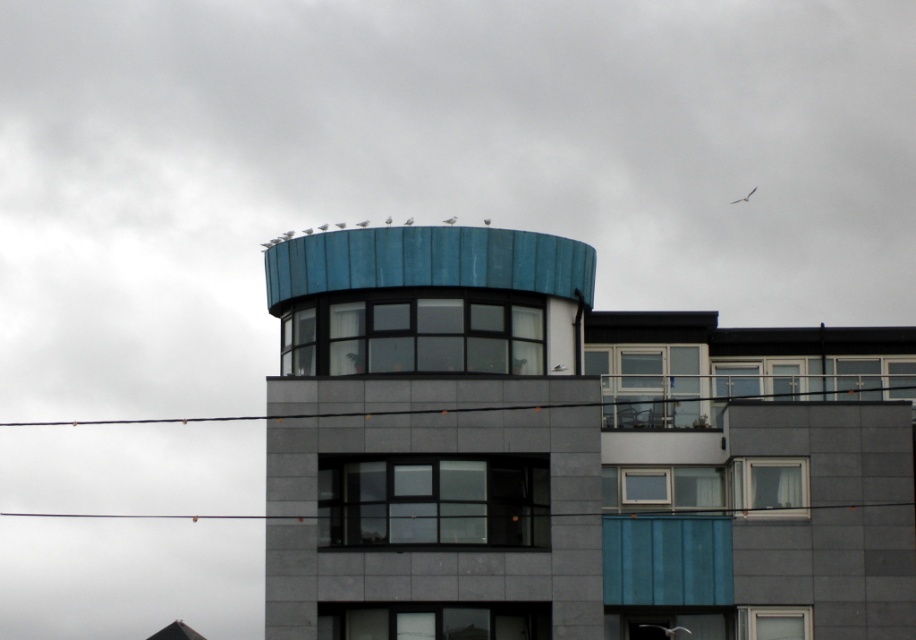
You are standing outside the modern building and want to take a photo of the blue textured tower at upper center without any obstructions. Is the white plastic window at lower right blocking your view of the tower?

The blue textured tower at upper center is positioned over the white plastic window at lower right, so the window is blocking the view of the tower.

You are an architect reviewing the building design. You notice the blue textured tower at upper center and the white plastic window at lower right. Which of these two elements has a larger size according to the design specifications?

The blue textured tower at upper center is bigger than the white plastic window at lower right, so the blue textured tower at upper center has a larger size according to the design specifications.